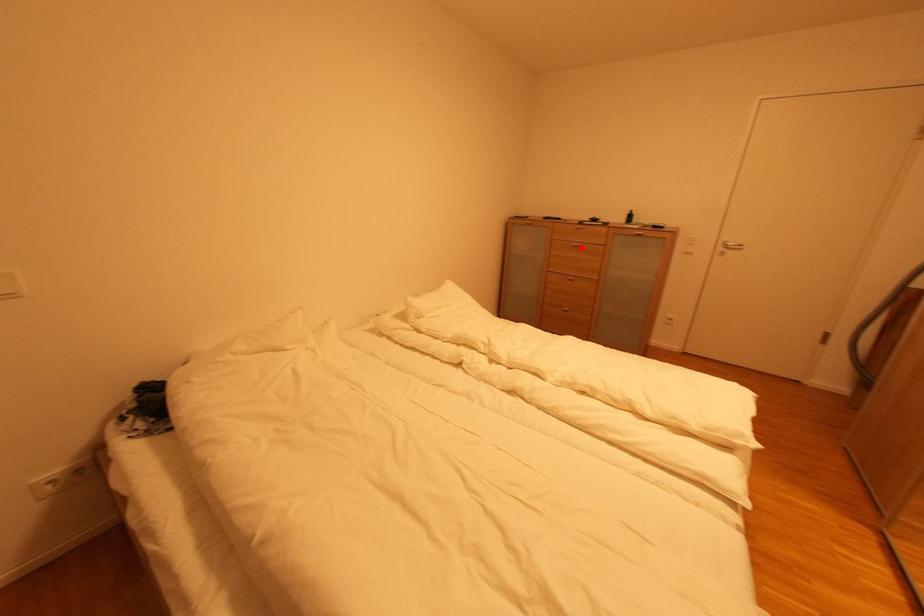
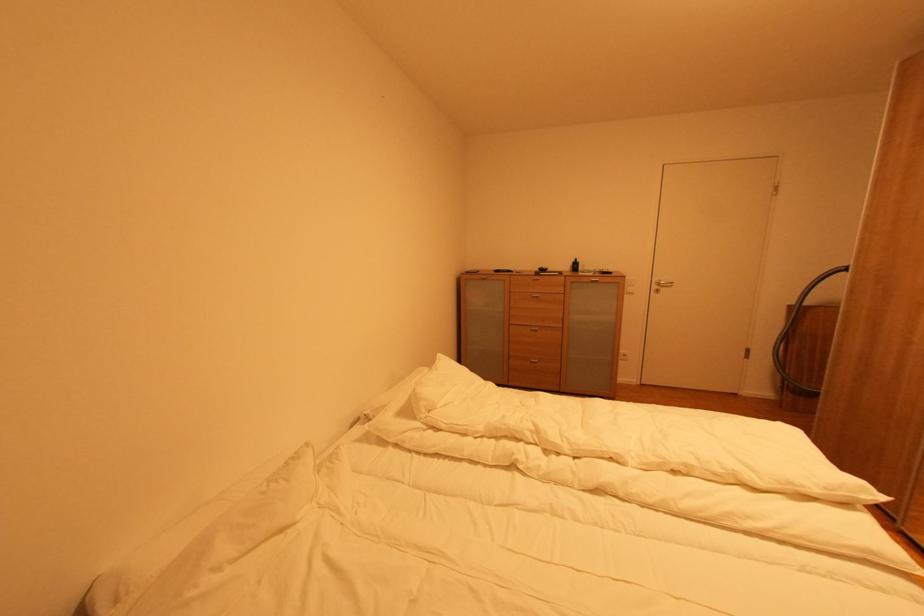
Locate, in the second image, the point that corresponds to the highlighted location in the first image.

(542, 298)